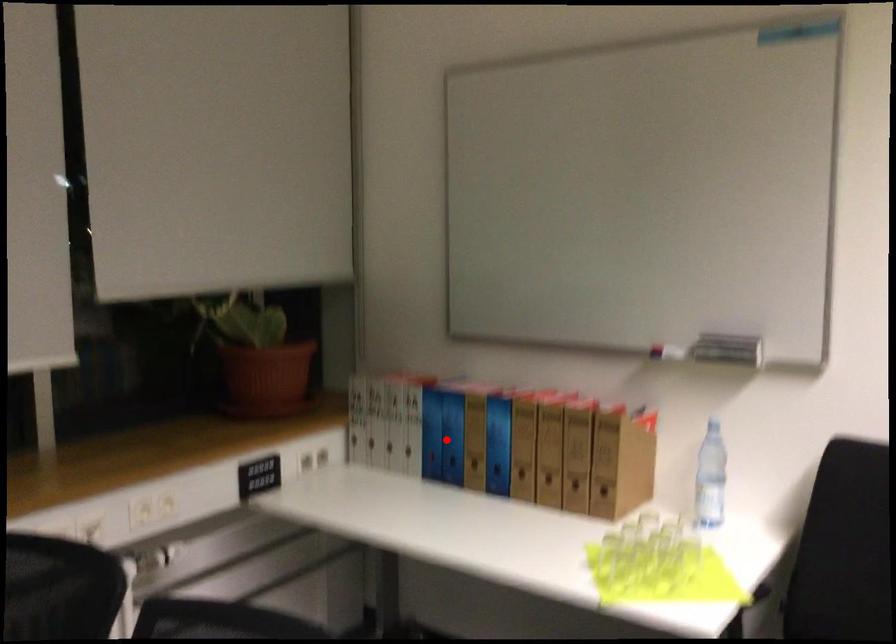
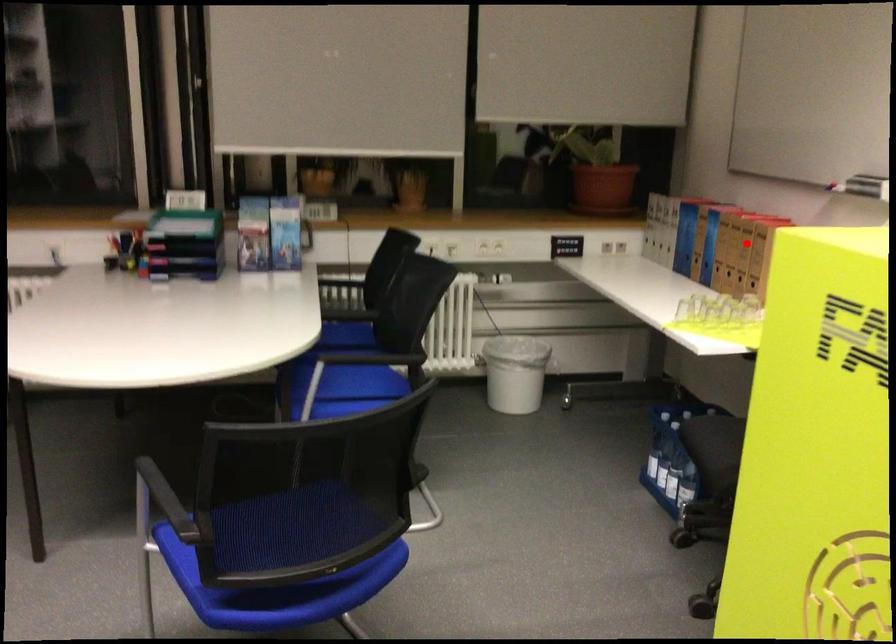
I am providing you with two images of the same scene from different viewpoints. A red point is marked on the first image and another point is marked on the second image. Do the highlighted points in image1 and image2 indicate the same real-world spot?

No